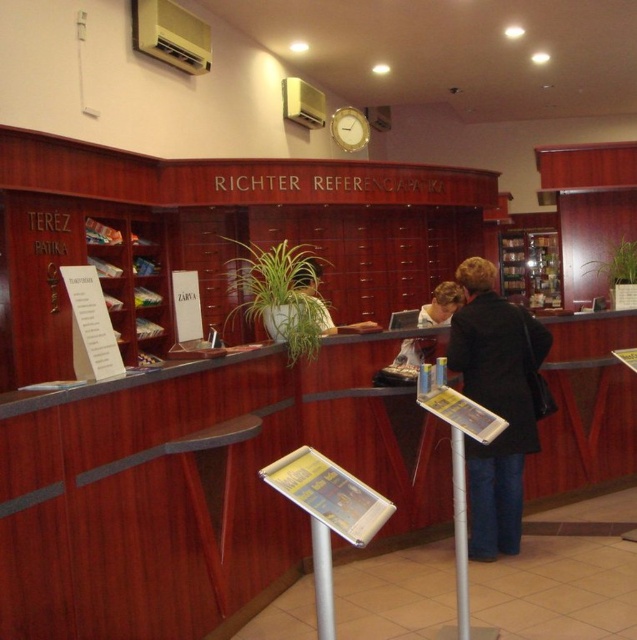
Question: Which point appears closest to the camera in this image?

Choices:
 (A) (327, 548)
 (B) (466, 388)
 (C) (412, 360)
 (D) (610, 326)

Answer: (A)

Question: Can you confirm if wooden desk at center is smaller than metallic silver pole at center?

Choices:
 (A) no
 (B) yes

Answer: (A)

Question: Which object appears closest to the camera in this image?

Choices:
 (A) matte black jacket at center
 (B) silver metallic pole at lower center
 (C) wooden desk at center

Answer: (B)

Question: Is black matte coat at center to the left of matte black jacket at center from the viewer's perspective?

Choices:
 (A) no
 (B) yes

Answer: (A)

Question: Among these objects, which one is nearest to the camera?

Choices:
 (A) black matte coat at center
 (B) wooden desk at center
 (C) metallic silver pole at center

Answer: (B)

Question: Can you confirm if black matte coat at center is bigger than matte black jacket at center?

Choices:
 (A) no
 (B) yes

Answer: (B)